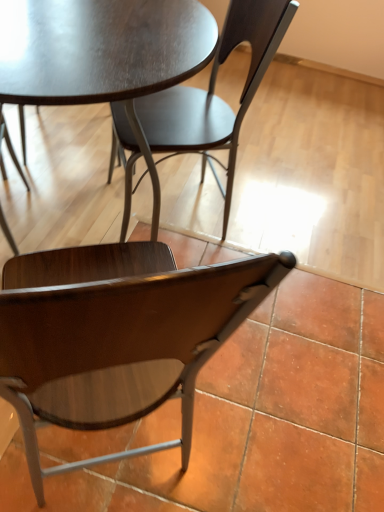
Question: In terms of width, does matte dark wood table at center look wider or thinner when compared to wooden chair at lower center, which ranks as the 1th chair in bottom-to-top order?

Choices:
 (A) wide
 (B) thin

Answer: (A)

Question: From their relative heights in the image, would you say matte dark wood table at center is taller or shorter than wooden chair at lower center, the second chair in the top-to-bottom sequence?

Choices:
 (A) tall
 (B) short

Answer: (B)

Question: Based on their relative distances, which object is nearer to the matte dark wood table at center?

Choices:
 (A) matte dark wood chair at center, the 2th chair ordered from the bottom
 (B) wooden chair at lower center, which ranks as the 1th chair in bottom-to-top order

Answer: (A)

Question: Based on their relative distances, which object is farther from the wooden chair at lower center, which ranks as the 1th chair in bottom-to-top order?

Choices:
 (A) matte dark wood chair at center, which is the 1th chair from top to bottom
 (B) matte dark wood table at center

Answer: (A)